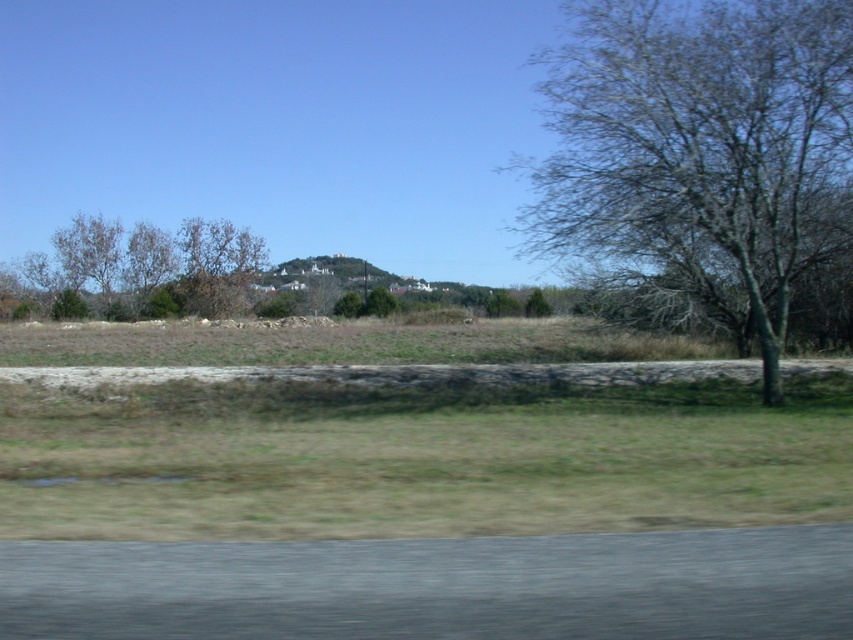
Question: Does bare wood tree at right have a larger size compared to green leafy tree at upper left?

Choices:
 (A) no
 (B) yes

Answer: (B)

Question: Which point is farther to the camera?

Choices:
 (A) bare wood tree at right
 (B) brown leafless tree at center
 (C) green leafy tree at upper left
 (D) brown grass at center

Answer: (B)

Question: Is bare wood tree at right further to camera compared to green leafy tree at upper left?

Choices:
 (A) yes
 (B) no

Answer: (B)

Question: Is bare wood tree at right closer to the viewer compared to brown leafless tree at center?

Choices:
 (A) yes
 (B) no

Answer: (A)

Question: Which point appears closest to the camera in this image?

Choices:
 (A) (619, 339)
 (B) (224, 246)
 (C) (231, 225)

Answer: (A)

Question: Which point is farther to the camera?

Choices:
 (A) bare wood tree at right
 (B) green leafy tree at upper left

Answer: (B)